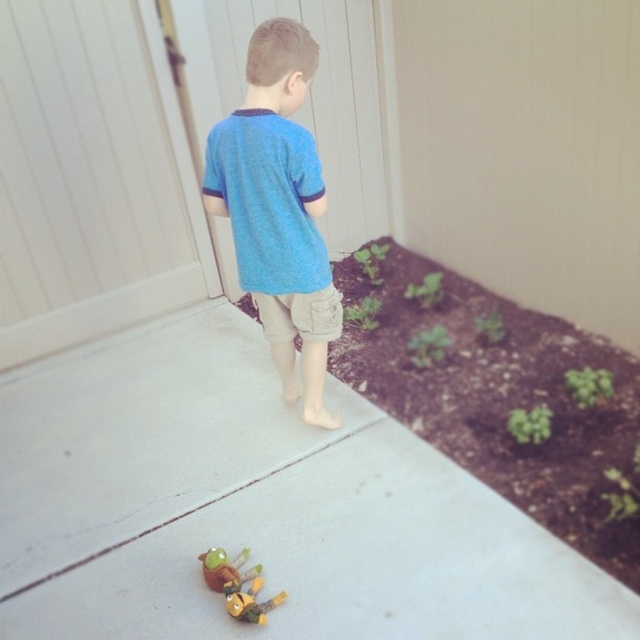
Can you confirm if white concrete pavement at center is positioned above blue cotton shirt at center?

No.

Is white concrete pavement at center taller than blue cotton shirt at center?

No, white concrete pavement at center is not taller than blue cotton shirt at center.

Is point (376, 448) closer to viewer compared to point (257, 138)?

No, it is not.

Identify the location of white concrete pavement at center. This screenshot has height=640, width=640. click(x=256, y=506).

Can you confirm if blue cotton shirt at center is bigger than plush yellow toy at lower center?

Yes, blue cotton shirt at center is bigger than plush yellow toy at lower center.

Does point (260, 240) come closer to viewer compared to point (275, 595)?

No, it is not.

Where is `blue cotton shirt at center`? Image resolution: width=640 pixels, height=640 pixels. blue cotton shirt at center is located at coordinates (278, 209).

Measure the distance between white concrete pavement at center and plush yellow toy at lower center.

The distance of white concrete pavement at center from plush yellow toy at lower center is 46.91 centimeters.

Does white concrete pavement at center have a smaller size compared to plush yellow toy at lower center?

Incorrect, white concrete pavement at center is not smaller in size than plush yellow toy at lower center.

Identify the location of white concrete pavement at center. (256, 506).